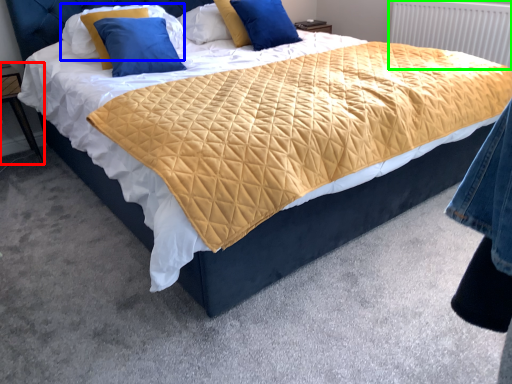
Question: Considering the real-world distances, which object is closest to nightstand (highlighted by a red box)? pillow (highlighted by a blue box) or radiator (highlighted by a green box).

Choices:
 (A) pillow
 (B) radiator

Answer: (A)